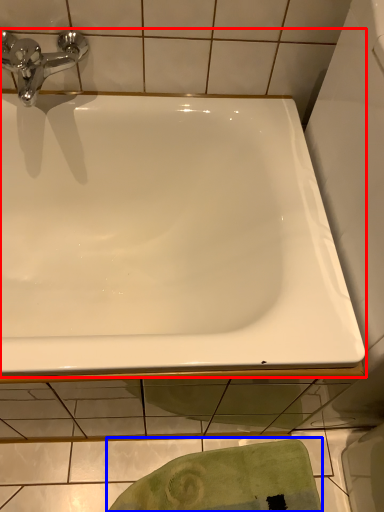
Question: Among these objects, which one is nearest to the camera, bathtub (highlighted by a red box) or bath towel (highlighted by a blue box)?

Choices:
 (A) bathtub
 (B) bath towel

Answer: (A)